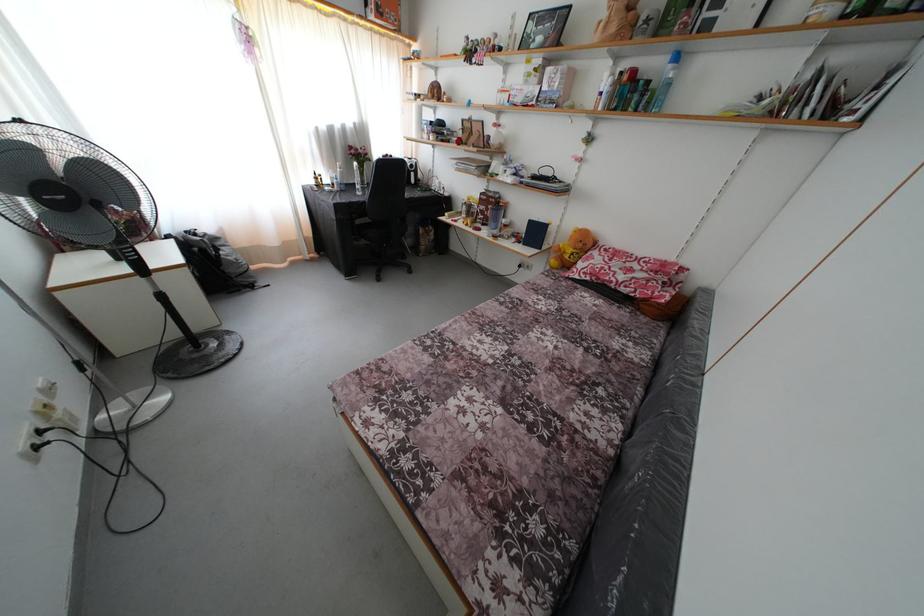
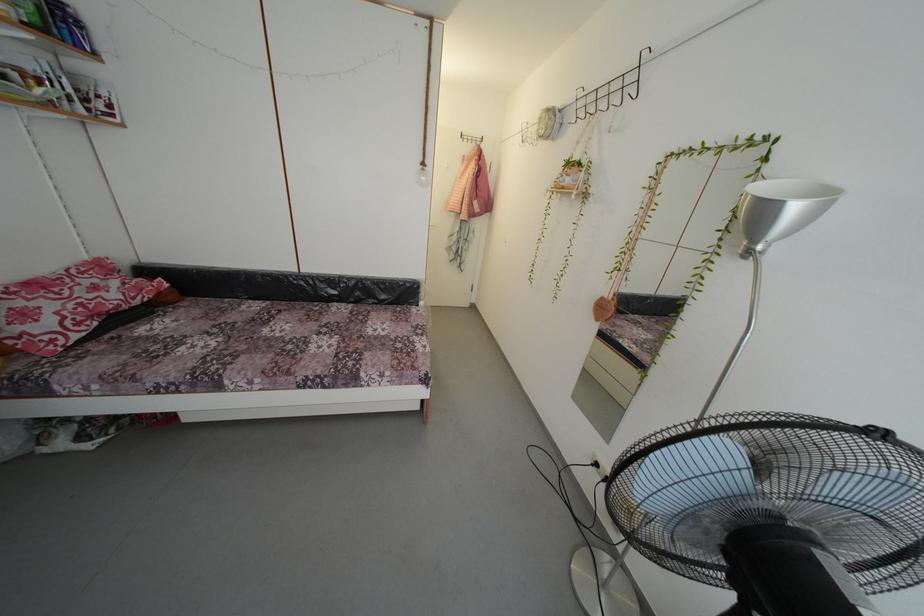
In the second image, find the point that corresponds to [550,315] in the first image.

(225, 345)